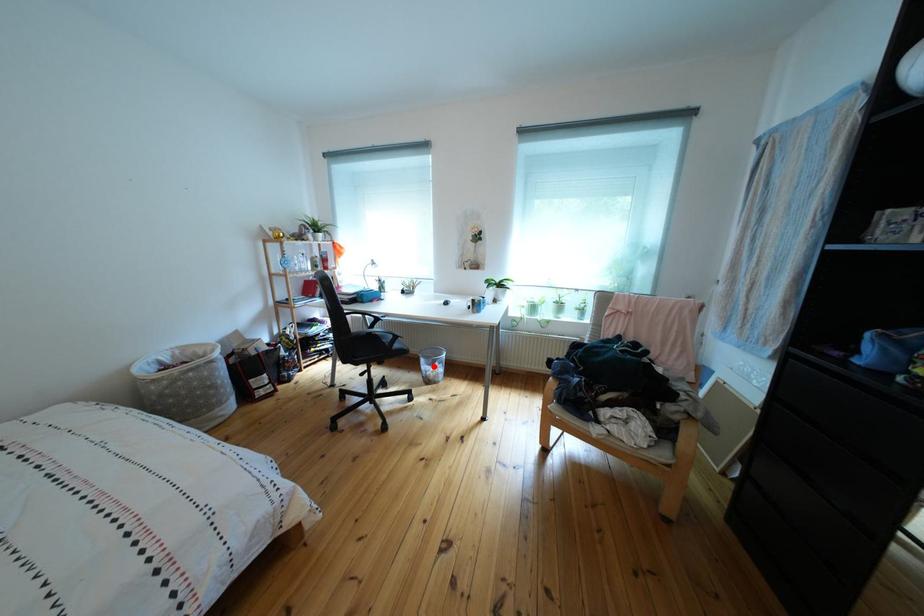
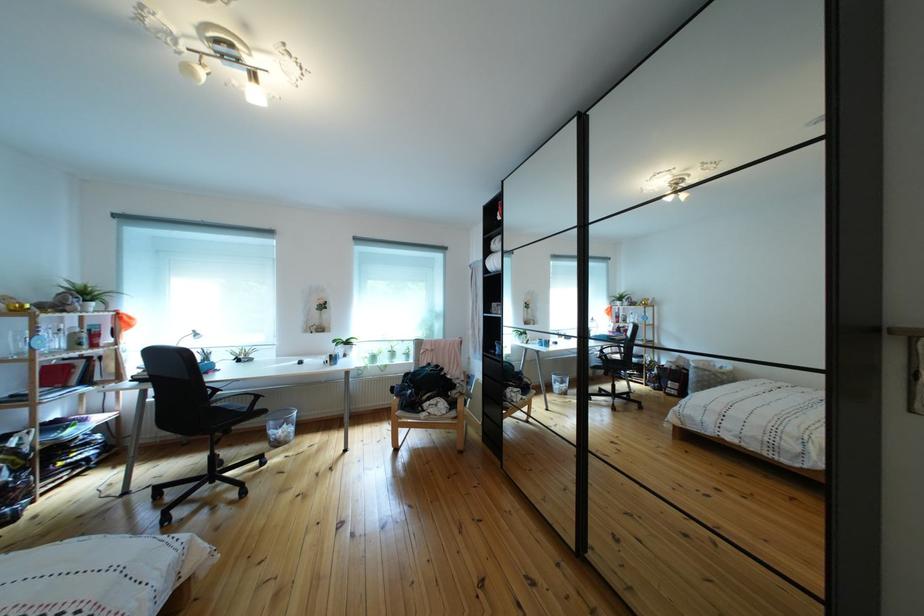
Question: A red point is marked in image1. In image2, is the corresponding 3D point closer to the camera or farther? Reply with the corresponding letter.

Choices:
 (A) The corresponding 3D point is closer.
 (B) The corresponding 3D point is farther.

Answer: (A)